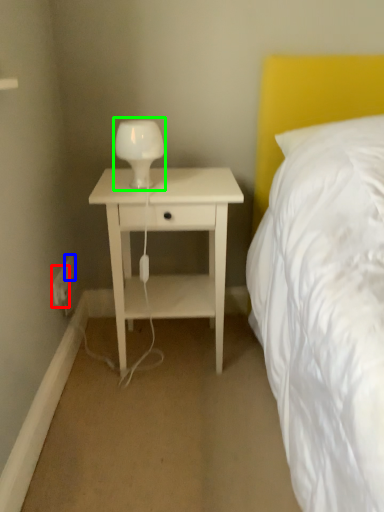
Question: Which object is the closest to the electric outlet (highlighted by a red box)? Choose among these: electric outlet (highlighted by a blue box) or bedside lamp (highlighted by a green box).

Choices:
 (A) electric outlet
 (B) bedside lamp

Answer: (A)